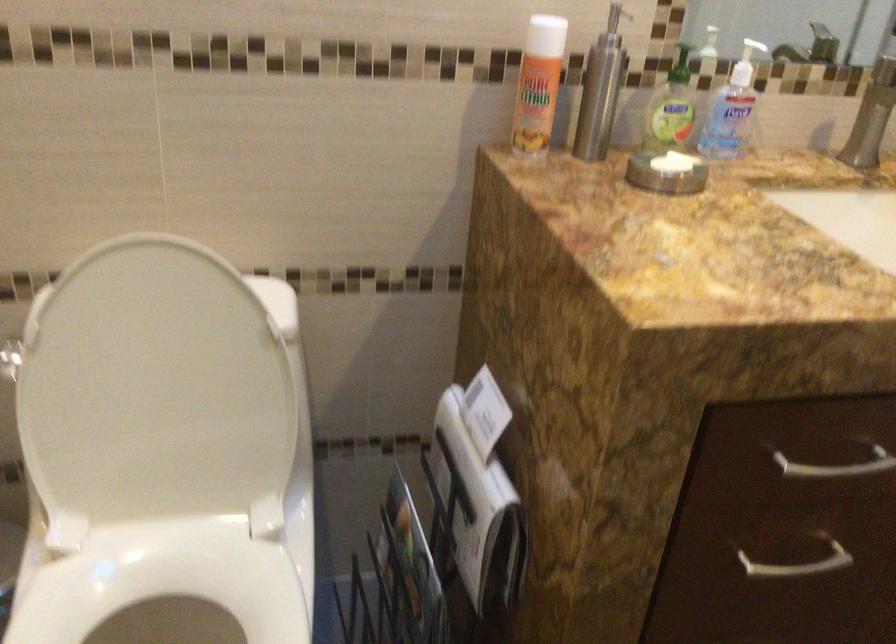
What do you see at coordinates (166, 594) in the screenshot?
I see `the white toilet seat` at bounding box center [166, 594].